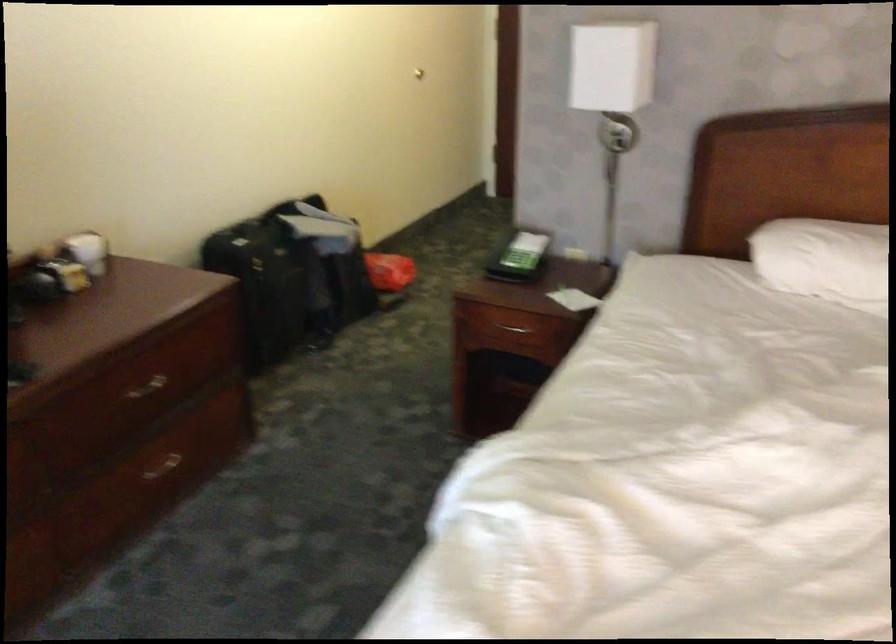
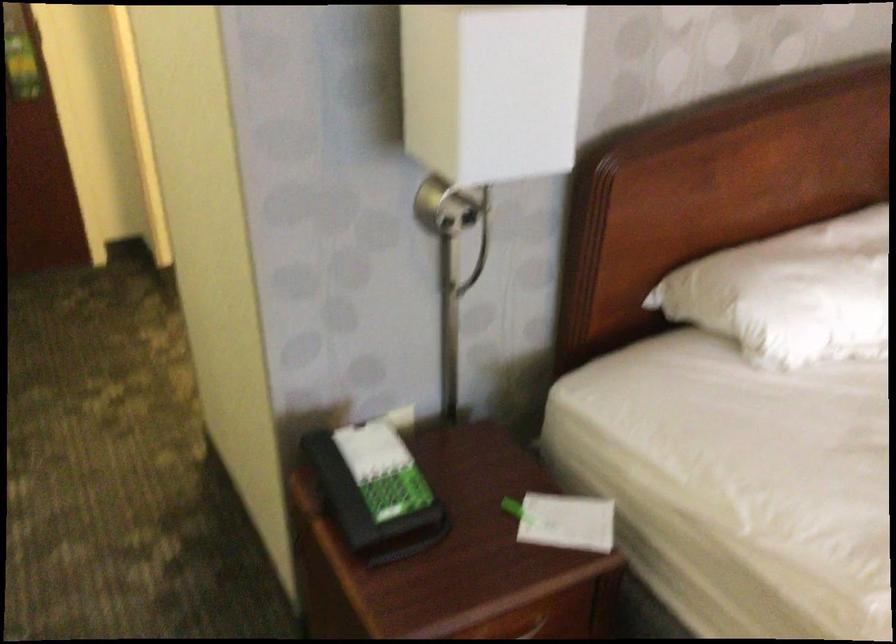
The point at [528,254] is marked in the first image. Where is the corresponding point in the second image?

(375, 491)